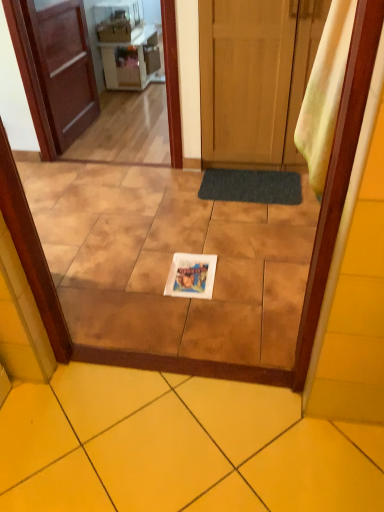
The width and height of the screenshot is (384, 512). I want to click on empty space that is ontop of white glossy book at center, so click(x=190, y=273).